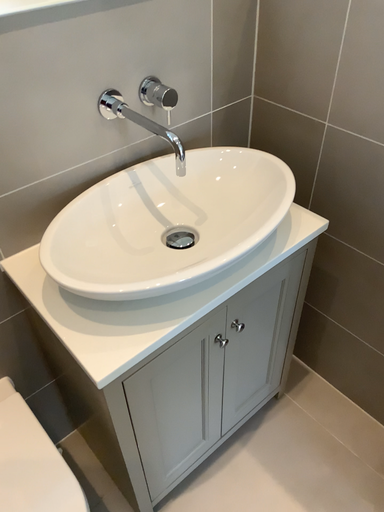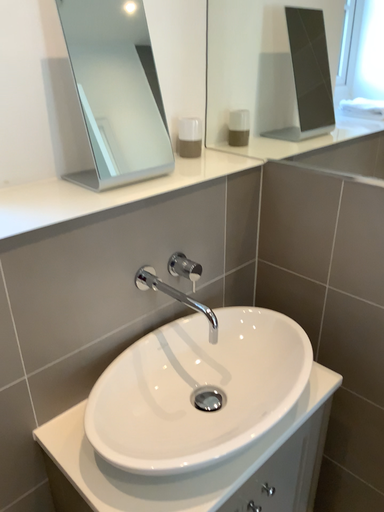
Question: Which way did the camera rotate in the video?

Choices:
 (A) rotated upward
 (B) rotated downward

Answer: (A)